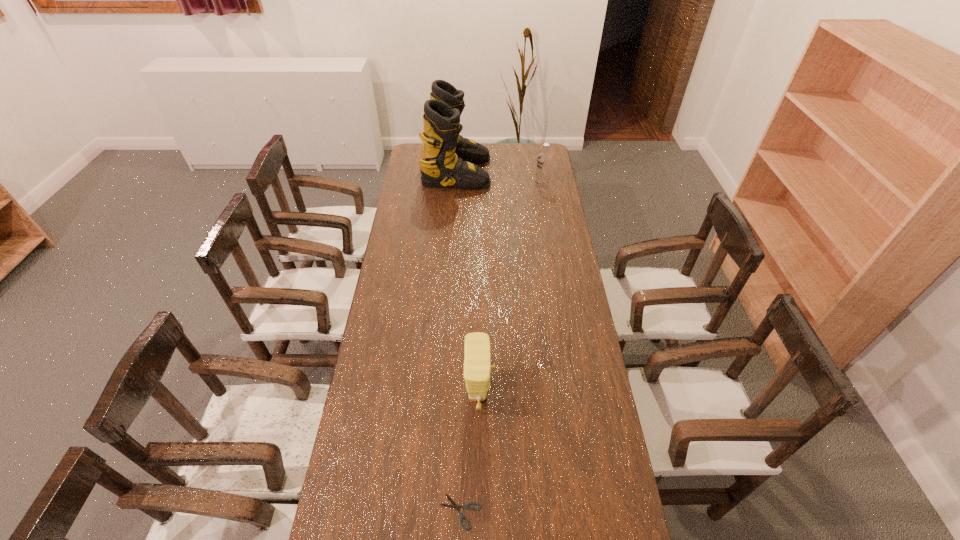
Find the location of a particular element. Image resolution: width=960 pixels, height=540 pixels. unoccupied area between the third farthest object and the nearest object is located at coordinates (469, 453).

Where is `unoccupied position between the shortest object and the vodka`? unoccupied position between the shortest object and the vodka is located at coordinates (501, 348).

Where is `vacant space that is in between the rightmost object and the sponge`? vacant space that is in between the rightmost object and the sponge is located at coordinates (511, 289).

Find the location of a particular element. free space between the sponge and the tallest object is located at coordinates (468, 283).

Where is `free space between the rightmost object and the shears`? This screenshot has width=960, height=540. free space between the rightmost object and the shears is located at coordinates (501, 348).

Find the location of a particular element. Image resolution: width=960 pixels, height=540 pixels. empty location between the rightmost object and the third farthest object is located at coordinates (511, 289).

You are a GUI agent. You are given a task and a screenshot of the screen. Output one action in this format:
    pyautogui.click(x=<x>, y=<y>)
    Task: Click on the vacant space in between the sponge and the vodka
    This screenshot has height=540, width=960.
    Given the screenshot: What is the action you would take?
    pyautogui.click(x=511, y=289)

Identify which object is the nearest to the shortest object. Please provide its 2D coordinates. Your answer should be formatted as a tuple, i.e. [(x, y)], where the tuple contains the x and y coordinates of a point satisfying the conditions above.

[(477, 358)]

Identify which object is the third closest to the shears. Please provide its 2D coordinates. Your answer should be formatted as a tuple, i.e. [(x, y)], where the tuple contains the x and y coordinates of a point satisfying the conditions above.

[(544, 161)]

At what (x,y) coordinates should I click in order to perform the action: click on vacant position in the image that satisfies the following two spatial constraints: 1. on the face of the second nearest object; 2. on the front side of the nearest object. Please return your answer as a coordinate pair (x, y). The image size is (960, 540). Looking at the image, I should click on (480, 511).